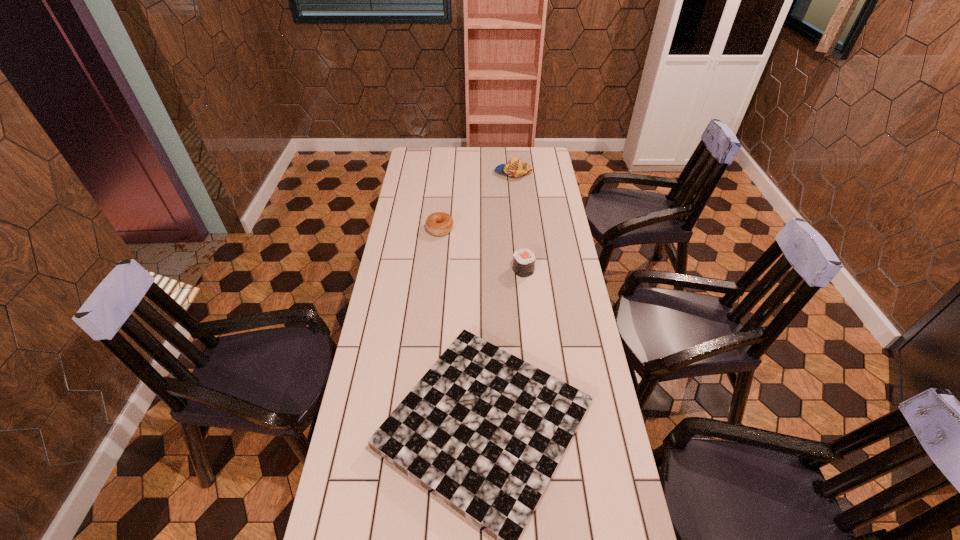
I want to click on unoccupied position between the farthest object and the sushi, so click(518, 221).

At what (x,y) coordinates should I click in order to perform the action: click on blank region between the third nearest object and the farthest object. Please return your answer as a coordinate pair (x, y). Image resolution: width=960 pixels, height=540 pixels. Looking at the image, I should click on (476, 201).

At what (x,y) coordinates should I click in order to perform the action: click on the second closest object relative to the bagel. Please return your answer as a coordinate pair (x, y). Looking at the image, I should click on (515, 167).

Identify which object is located as the nearest to the bagel. Please provide its 2D coordinates. Your answer should be formatted as a tuple, i.e. [(x, y)], where the tuple contains the x and y coordinates of a point satisfying the conditions above.

[(523, 260)]

In order to click on vacant area that satisfies the following two spatial constraints: 1. on the bill of the cap; 2. on the back side of the sushi in this screenshot , I will do `click(523, 270)`.